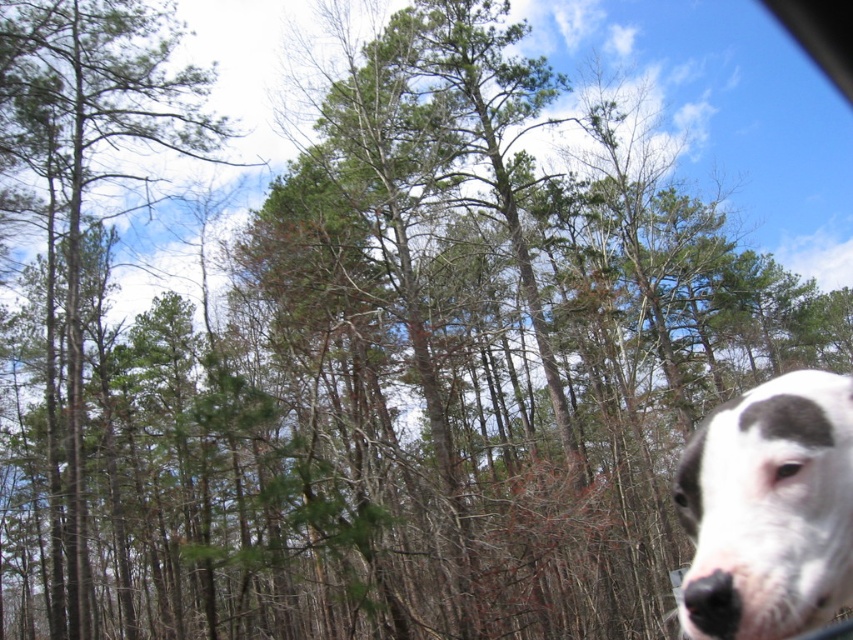
Can you confirm if white fur dog at lower right is bigger than green leafy tree at upper left?

Actually, white fur dog at lower right might be smaller than green leafy tree at upper left.

Is white fur dog at lower right to the right of green leafy tree at upper left from the viewer's perspective?

Correct, you'll find white fur dog at lower right to the right of green leafy tree at upper left.

From the picture: Who is more forward, (747, 621) or (97, 56)?

Point (747, 621) is more forward.

Find the location of a particular element. This screenshot has width=853, height=640. white fur dog at lower right is located at coordinates (769, 509).